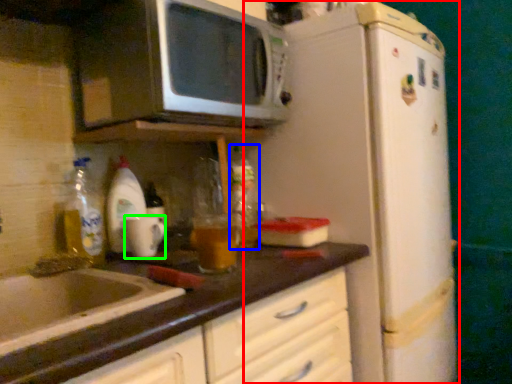
Question: Based on their relative distances, which object is farther from refrigerator (highlighted by a red box)? Choose from bottle (highlighted by a blue box) and mug (highlighted by a green box).

Choices:
 (A) bottle
 (B) mug

Answer: (B)